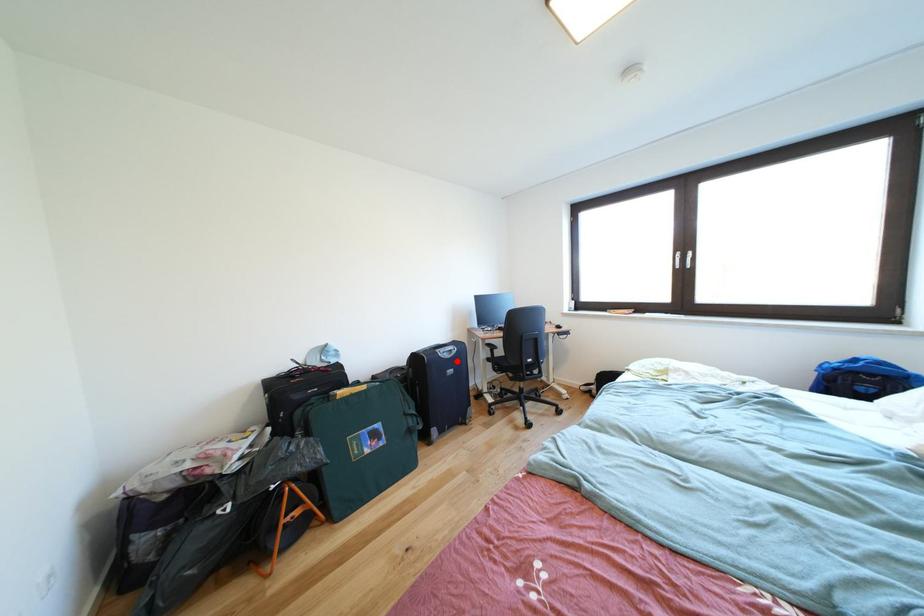
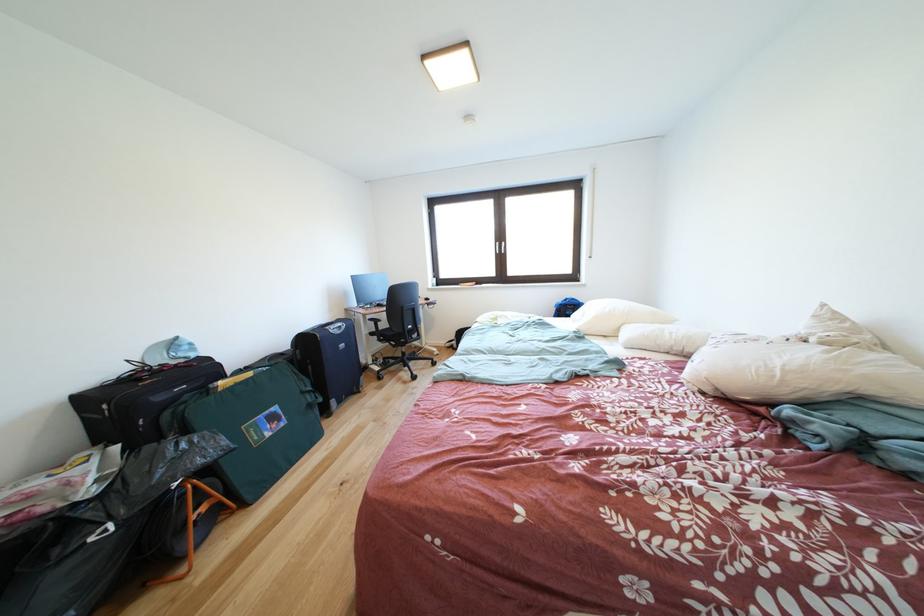
Locate, in the second image, the point that corresponds to the highlighted location in the first image.

(347, 337)